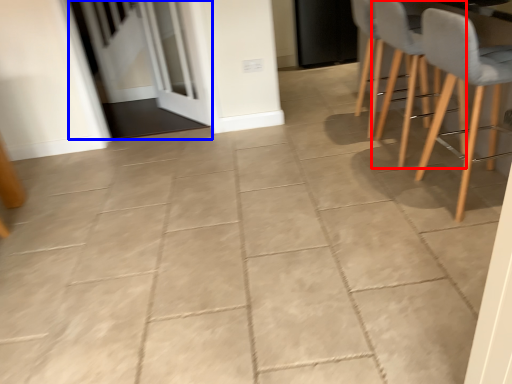
Question: Which object appears farthest to the camera in this image, armchair (highlighted by a red box) or screen door (highlighted by a blue box)?

Choices:
 (A) armchair
 (B) screen door

Answer: (B)